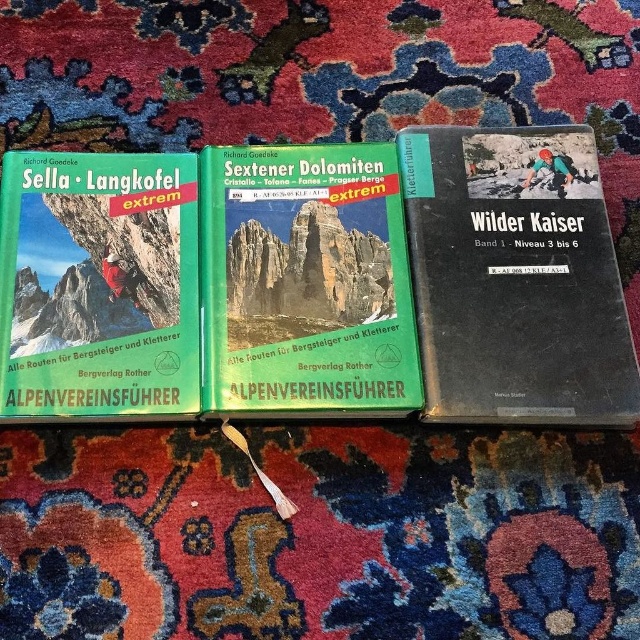
Is point (438, 356) behind point (346, 156)?

No, it is in front of (346, 156).

Does black matte book at right have a lesser height compared to green matte book at center?

Incorrect, black matte book at right's height does not fall short of green matte book at center's.

Which is behind, point (461, 413) or point (362, 243)?

The point (362, 243) is behind.

I want to click on black matte book at right, so click(x=515, y=276).

Which of these two, green matte book at center or green matte book at left, stands shorter?

With less height is green matte book at left.

Is point (360, 250) positioned before point (108, 346)?

No, (360, 250) is further to viewer.

Where is `green matte book at center`? green matte book at center is located at coordinates (305, 282).

Can you confirm if black matte book at right is positioned to the left of green matte book at left?

Incorrect, black matte book at right is not on the left side of green matte book at left.

Does black matte book at right appear over green matte book at left?

Indeed, black matte book at right is positioned over green matte book at left.

Based on the photo, who is more distant from viewer, [547,264] or [22,314]?

The point [547,264] is behind.

At what (x,y) coordinates should I click in order to perform the action: click on black matte book at right. Please return your answer as a coordinate pair (x, y). Looking at the image, I should click on (515, 276).